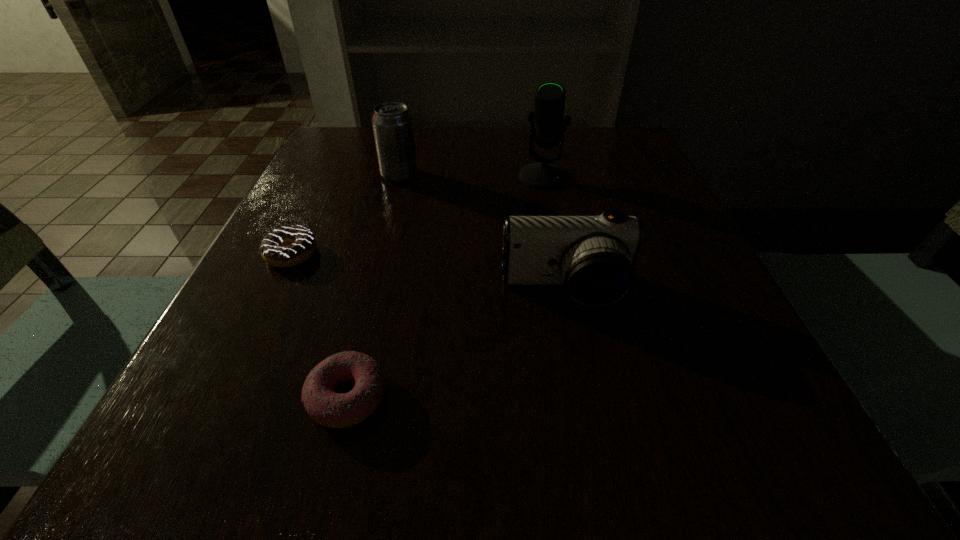
Locate an element on the screen. The height and width of the screenshot is (540, 960). vacant area that lies between the right doughnut and the microphone is located at coordinates (445, 287).

Identify the location of free space between the tallest object and the nearest object. Image resolution: width=960 pixels, height=540 pixels. (445, 287).

Identify the location of object identified as the third closest to the camcorder. (287, 246).

Find the location of a particular element. This screenshot has height=540, width=960. object identified as the third closest to the camcorder is located at coordinates (287, 246).

Identify the location of free spot that satisfies the following two spatial constraints: 1. on the back side of the soda can; 2. on the right side of the leftmost object. This screenshot has width=960, height=540. (330, 175).